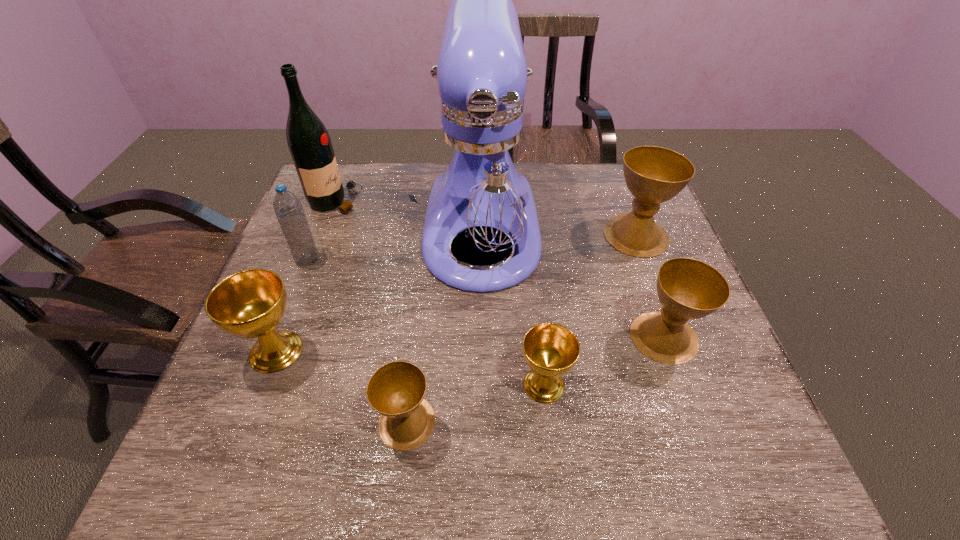
The image size is (960, 540). In order to click on blank region between the tallest object and the third chalice from left to right in this screenshot , I will do `click(513, 307)`.

Where is `free spot between the tallest chalice and the nearest brown chalice`? The height and width of the screenshot is (540, 960). free spot between the tallest chalice and the nearest brown chalice is located at coordinates pyautogui.click(x=521, y=328).

Locate an element on the screen. This screenshot has height=540, width=960. vacant area that lies between the wine bottle and the blue mixer is located at coordinates (409, 215).

Identify the location of object that ranks as the closest to the tallest chalice. The height and width of the screenshot is (540, 960). (481, 183).

Select which object appears as the fourth closest to the wine bottle. Please provide its 2D coordinates. Your answer should be formatted as a tuple, i.e. [(x, y)], where the tuple contains the x and y coordinates of a point satisfying the conditions above.

[(396, 390)]

Where is `chalice that stands as the fourth closest to the blue water bottle`? The width and height of the screenshot is (960, 540). chalice that stands as the fourth closest to the blue water bottle is located at coordinates 653,175.

Select which chalice is the fourth closest to the leftmost chalice. Please provide its 2D coordinates. Your answer should be formatted as a tuple, i.e. [(x, y)], where the tuple contains the x and y coordinates of a point satisfying the conditions above.

[(653, 175)]

Identify which brown chalice is the second nearest to the smallest brown chalice. Please provide its 2D coordinates. Your answer should be formatted as a tuple, i.e. [(x, y)], where the tuple contains the x and y coordinates of a point satisfying the conditions above.

[(653, 175)]

Locate which brown chalice ranks in proximity to the farthest chalice. Please provide its 2D coordinates. Your answer should be formatted as a tuple, i.e. [(x, y)], where the tuple contains the x and y coordinates of a point satisfying the conditions above.

[(688, 289)]

The height and width of the screenshot is (540, 960). Identify the location of free space that satisfies the following two spatial constraints: 1. at the mixing area of the mixer; 2. on the left side of the smaller gold chalice. (482, 385).